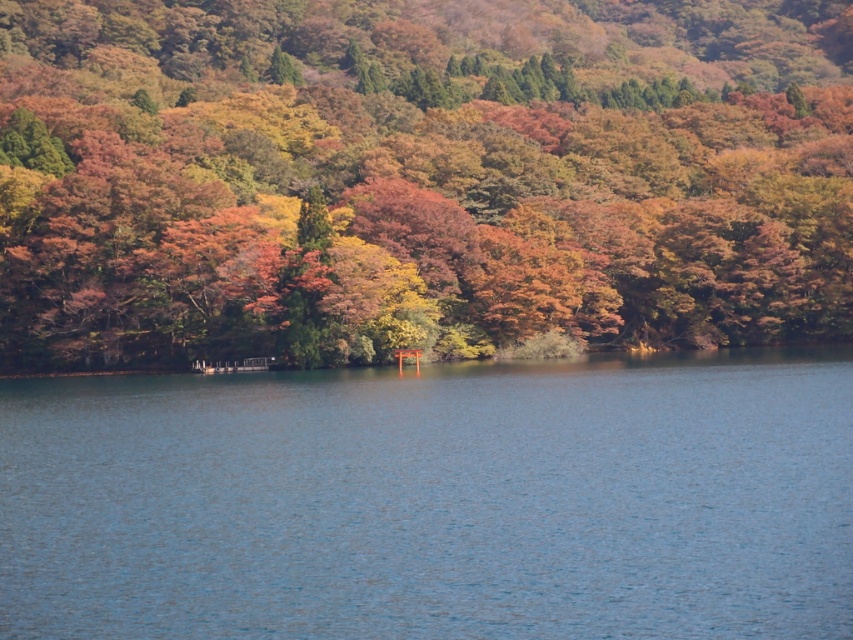
Is autumn leaves at center bigger than blue water at center?

Indeed, autumn leaves at center has a larger size compared to blue water at center.

Does point (39, 45) lie behind point (372, 625)?

Yes, point (39, 45) is behind point (372, 625).

Where is `autumn leaves at center`? The width and height of the screenshot is (853, 640). autumn leaves at center is located at coordinates (418, 176).